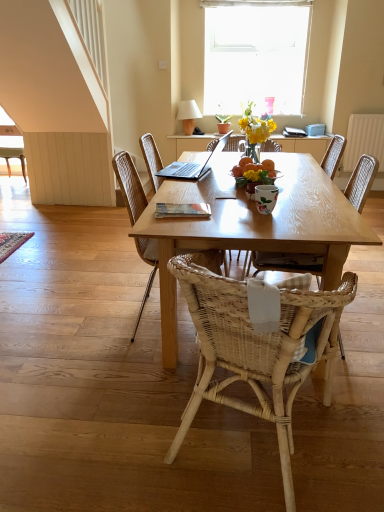
Question: Is point (129, 200) closer or farther from the camera than point (205, 205)?

Choices:
 (A) farther
 (B) closer

Answer: (A)

Question: Considering the positions of woven wood chair at center, the third chair viewed from the right, and wooden book at center in the image, is woven wood chair at center, the third chair viewed from the right, wider or thinner than wooden book at center?

Choices:
 (A) wide
 (B) thin

Answer: (A)

Question: Considering the real-world distances, which object is farthest from the white fabric lampshade at upper center?

Choices:
 (A) woven wood chair at left, positioned as the 1th chair in back-to-front order
 (B) woven wood chair at center, the first chair in the front-to-back sequence
 (C) green leafy plant at upper center
 (D) woven wood chair at center, the 3th chair in the front-to-back sequence
 (E) satin silver laptop at center

Answer: (B)

Question: Which object is positioned farthest from the satin silver laptop at center?

Choices:
 (A) woven rattan chair at center, which ranks as the 2th chair in front-to-back order
 (B) white glossy coffee cup at center
 (C) wooden book at center
 (D) white textured curtain at upper center
 (E) woven wood chair at center, the third chair viewed from the right

Answer: (D)